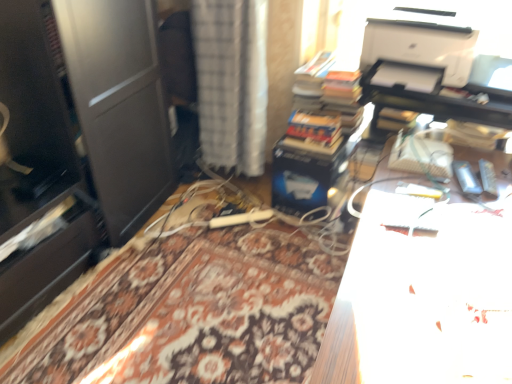
The image size is (512, 384). What are the coordinates of `white matte printer at upper right` in the screenshot? It's located at click(421, 41).

Where is `white textured curtain at center`? This screenshot has height=384, width=512. white textured curtain at center is located at coordinates (232, 82).

Find the location of a particular element. The image size is (512, 384). white glossy paper at upper right is located at coordinates 423,294.

Considering the sizes of white glossy paper at upper right and hardcover books at center in the image, is white glossy paper at upper right bigger or smaller than hardcover books at center?

white glossy paper at upper right is bigger than hardcover books at center.

Considering the sizes of objects white glossy paper at upper right and hardcover books at center in the image provided, who is thinner, white glossy paper at upper right or hardcover books at center?

hardcover books at center.

Would you say white glossy paper at upper right is inside or outside hardcover books at center?

white glossy paper at upper right is not inside hardcover books at center, it's outside.

Is white glossy paper at upper right in front of or behind hardcover books at center in the image?

Visually, white glossy paper at upper right is located in front of hardcover books at center.

Between white textured curtain at center and hardcover books at center, which one is positioned in front?

white textured curtain at center is closer to the camera.

Looking at this image, would you consider white textured curtain at center to be distant from hardcover books at center?

No.

Consider the image. Considering the relative sizes of white textured curtain at center and hardcover books at center in the image provided, is white textured curtain at center bigger than hardcover books at center?

Correct, white textured curtain at center is larger in size than hardcover books at center.

Considering the sizes of objects hardcover books at center and white glossy paper at upper right in the image provided, who is taller, hardcover books at center or white glossy paper at upper right?

Standing taller between the two is white glossy paper at upper right.

The height and width of the screenshot is (384, 512). I want to click on table below the hardcover books at center (from a real-world perspective), so click(423, 294).

Does hardcover books at center have a larger size compared to white glossy paper at upper right?

No.

Is hardcover books at center far away from white glossy paper at upper right?

No, hardcover books at center is not far away from white glossy paper at upper right.

The width and height of the screenshot is (512, 384). What are the coordinates of `curtain on the left of white matte printer at upper right` in the screenshot? It's located at (232, 82).

Considering the relative positions of white matte printer at upper right and white textured curtain at center in the image provided, is white matte printer at upper right behind white textured curtain at center?

No, white matte printer at upper right is closer to the camera.

Does point (445, 52) come behind point (245, 48)?

That is False.

Considering the sizes of objects white matte printer at upper right and white textured curtain at center in the image provided, who is shorter, white matte printer at upper right or white textured curtain at center?

white matte printer at upper right is shorter.

From the image's perspective, does hardcover books at center appear higher than white matte printer at upper right?

No, from the image's perspective, hardcover books at center is not above white matte printer at upper right.

Which object is more forward, hardcover books at center or white matte printer at upper right?

white matte printer at upper right is closer to the camera.

Is hardcover books at center surrounding white matte printer at upper right?

No, white matte printer at upper right is not surrounded by hardcover books at center.

Is white matte printer at upper right at the back of hardcover books at center?

No.

Considering the relative sizes of white glossy paper at upper right and white matte printer at upper right in the image provided, is white glossy paper at upper right thinner than white matte printer at upper right?

In fact, white glossy paper at upper right might be wider than white matte printer at upper right.

From the image's perspective, is white glossy paper at upper right beneath white matte printer at upper right?

Correct, white glossy paper at upper right appears lower than white matte printer at upper right in the image.

Considering the sizes of objects white glossy paper at upper right and white matte printer at upper right in the image provided, who is shorter, white glossy paper at upper right or white matte printer at upper right?

With less height is white matte printer at upper right.

Is white matte printer at upper right taller than hardcover books at center?

No.

Choose the correct answer: Is white matte printer at upper right inside hardcover books at center or outside it?

white matte printer at upper right lies outside hardcover books at center.

Which is less distant, (381, 28) or (324, 90)?

Clearly, point (381, 28) is closer to the camera than point (324, 90).

Is white matte printer at upper right in contact with hardcover books at center?

white matte printer at upper right and hardcover books at center are not in contact.

Identify the location of table on the right of hardcover books at center. The width and height of the screenshot is (512, 384). (423, 294).

In the image, there is a hardcover books at center. Identify the location of curtain above it (from the image's perspective). (232, 82).

From the image, which object appears to be nearer to white textured curtain at center, white matte printer at upper right or white glossy paper at upper right?

white matte printer at upper right.

Based on the photo, considering their positions, is hardcover books at center positioned closer to white textured curtain at center than white glossy paper at upper right?

hardcover books at center lies closer to white textured curtain at center than the other object.

When comparing their distances from white glossy paper at upper right, does white matte printer at upper right or white textured curtain at center seem closer?

Based on the image, white matte printer at upper right appears to be nearer to white glossy paper at upper right.

Based on their spatial positions, is hardcover books at center or white matte printer at upper right closer to white glossy paper at upper right?

white matte printer at upper right is closer to white glossy paper at upper right.

Which object lies nearer to the anchor point hardcover books at center, white glossy paper at upper right or white textured curtain at center?

white textured curtain at center is positioned closer to the anchor hardcover books at center.

Based on their spatial positions, is white textured curtain at center or white glossy paper at upper right closer to white matte printer at upper right?

white glossy paper at upper right lies closer to white matte printer at upper right than the other object.

Estimate the real-world distances between objects in this image. Which object is closer to white glossy paper at upper right, white textured curtain at center or white matte printer at upper right?

Based on the image, white matte printer at upper right appears to be nearer to white glossy paper at upper right.

Considering their positions, is white textured curtain at center positioned further to white matte printer at upper right than hardcover books at center?

Among the two, white textured curtain at center is located further to white matte printer at upper right.

Find the location of a particular element. The image size is (512, 384). printer between white glossy paper at upper right and white textured curtain at center in the front-back direction is located at coordinates (421, 41).

You are a GUI agent. You are given a task and a screenshot of the screen. Output one action in this format:
    pyautogui.click(x=<x>, y=<y>)
    Task: Click on the book between white textured curtain at center and white matte printer at upper right from left to right
    The width and height of the screenshot is (512, 384).
    Given the screenshot: What is the action you would take?
    pyautogui.click(x=324, y=84)

Where is `curtain between white glossy paper at upper right and hardcover books at center in the front-back direction`? This screenshot has width=512, height=384. curtain between white glossy paper at upper right and hardcover books at center in the front-back direction is located at coordinates (232, 82).

Find the location of `printer positioned between white glossy paper at upper right and hardcover books at center from near to far`. printer positioned between white glossy paper at upper right and hardcover books at center from near to far is located at coordinates (421, 41).